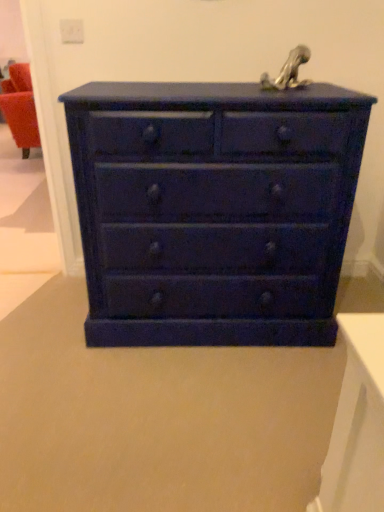
The width and height of the screenshot is (384, 512). Identify the location of matte blue chest of drawers at center. (214, 210).

What do you see at coordinates (214, 210) in the screenshot? I see `matte blue chest of drawers at center` at bounding box center [214, 210].

Where is `matte blue chest of drawers at center`? Image resolution: width=384 pixels, height=512 pixels. matte blue chest of drawers at center is located at coordinates (214, 210).